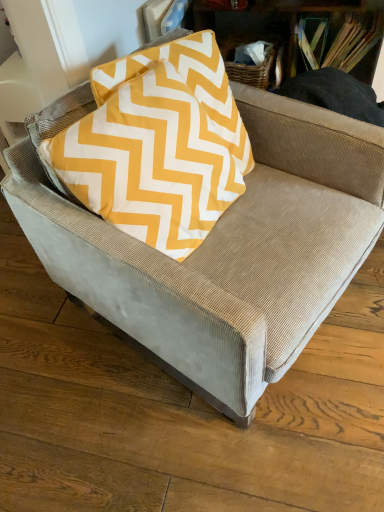
Measure the distance between wooden book at upper right and camera.

They are 5.34 feet apart.

Looking at this image, measure the distance between point (372, 40) and camera.

Point (372, 40) is 5.50 feet from camera.

The height and width of the screenshot is (512, 384). I want to click on wooden book at upper right, so click(338, 40).

What do you see at coordinates (338, 40) in the screenshot? Image resolution: width=384 pixels, height=512 pixels. I see `wooden book at upper right` at bounding box center [338, 40].

In order to face yellow fabric pillow at upper center, should I rotate leftwards or rightwards?

Rotate your view left by about 1.102°.

Image resolution: width=384 pixels, height=512 pixels. What do you see at coordinates (158, 146) in the screenshot? I see `yellow fabric pillow at upper center` at bounding box center [158, 146].

In the scene shown: Measure the distance between point (106, 213) and camera.

They are 1.01 meters apart.

The image size is (384, 512). Identify the location of yellow fabric pillow at upper center. (158, 146).

Find the location of a particular element. wooden book at upper right is located at coordinates (x=338, y=40).

Which is more to the left, yellow fabric pillow at upper center or wooden book at upper right?

Positioned to the left is yellow fabric pillow at upper center.

Which object is further away from the camera taking this photo, yellow fabric pillow at upper center or wooden book at upper right?

wooden book at upper right is further from the camera.

Considering the positions of points (119, 191) and (304, 26), is point (119, 191) closer to camera compared to point (304, 26)?

Yes, point (119, 191) is in front of point (304, 26).

From the image's perspective, is yellow fabric pillow at upper center above or below wooden book at upper right?

Based on their image positions, yellow fabric pillow at upper center is located beneath wooden book at upper right.

From a real-world perspective, who is located lower, yellow fabric pillow at upper center or wooden book at upper right?

From a 3D spatial view, wooden book at upper right is below.

Does yellow fabric pillow at upper center have a lesser width compared to wooden book at upper right?

Yes.

Considering the relative sizes of yellow fabric pillow at upper center and wooden book at upper right in the image provided, is yellow fabric pillow at upper center taller than wooden book at upper right?

Yes, yellow fabric pillow at upper center is taller than wooden book at upper right.

Is yellow fabric pillow at upper center bigger than wooden book at upper right?

Correct, yellow fabric pillow at upper center is larger in size than wooden book at upper right.

Do you think yellow fabric pillow at upper center is within wooden book at upper right, or outside of it?

yellow fabric pillow at upper center is not inside wooden book at upper right, it's outside.

Would you say yellow fabric pillow at upper center is a long distance from wooden book at upper right?

No, there isn't a large distance between yellow fabric pillow at upper center and wooden book at upper right.

Is yellow fabric pillow at upper center positioned with its back to wooden book at upper right?

No.

How many degrees apart are the facing directions of yellow fabric pillow at upper center and wooden book at upper right?

The facing directions of yellow fabric pillow at upper center and wooden book at upper right are 58.8 degrees apart.

Locate an element on the screen. The height and width of the screenshot is (512, 384). book behind the yellow fabric pillow at upper center is located at coordinates click(x=338, y=40).

Can you confirm if wooden book at upper right is positioned to the left of yellow fabric pillow at upper center?

Incorrect, wooden book at upper right is not on the left side of yellow fabric pillow at upper center.

Which object is more forward, wooden book at upper right or yellow fabric pillow at upper center?

Positioned in front is yellow fabric pillow at upper center.

Is point (302, 23) in front of point (239, 155)?

No, it is not.

From the image's perspective, does wooden book at upper right appear lower than yellow fabric pillow at upper center?

No.

From the picture: From a real-world perspective, is wooden book at upper right below yellow fabric pillow at upper center?

Yes, from a real-world perspective, wooden book at upper right is beneath yellow fabric pillow at upper center.

Considering the relative sizes of wooden book at upper right and yellow fabric pillow at upper center in the image provided, is wooden book at upper right wider than yellow fabric pillow at upper center?

Yes.

From the picture: Between wooden book at upper right and yellow fabric pillow at upper center, which one has more height?

With more height is yellow fabric pillow at upper center.

Between wooden book at upper right and yellow fabric pillow at upper center, which one has smaller size?

wooden book at upper right is smaller.

Is wooden book at upper right positioned beyond the bounds of yellow fabric pillow at upper center?

Indeed, wooden book at upper right is completely outside yellow fabric pillow at upper center.

Consider the image. Are wooden book at upper right and yellow fabric pillow at upper center beside each other?

No.

Is wooden book at upper right aimed at yellow fabric pillow at upper center?

Yes, wooden book at upper right is oriented towards yellow fabric pillow at upper center.

What are the coordinates of `book lying on the right of yellow fabric pillow at upper center` in the screenshot? It's located at (338, 40).

Find the location of a particular element. book below the yellow fabric pillow at upper center (from a real-world perspective) is located at coordinates 338,40.

Locate an element on the screen. This screenshot has height=512, width=384. book behind the yellow fabric pillow at upper center is located at coordinates (338, 40).